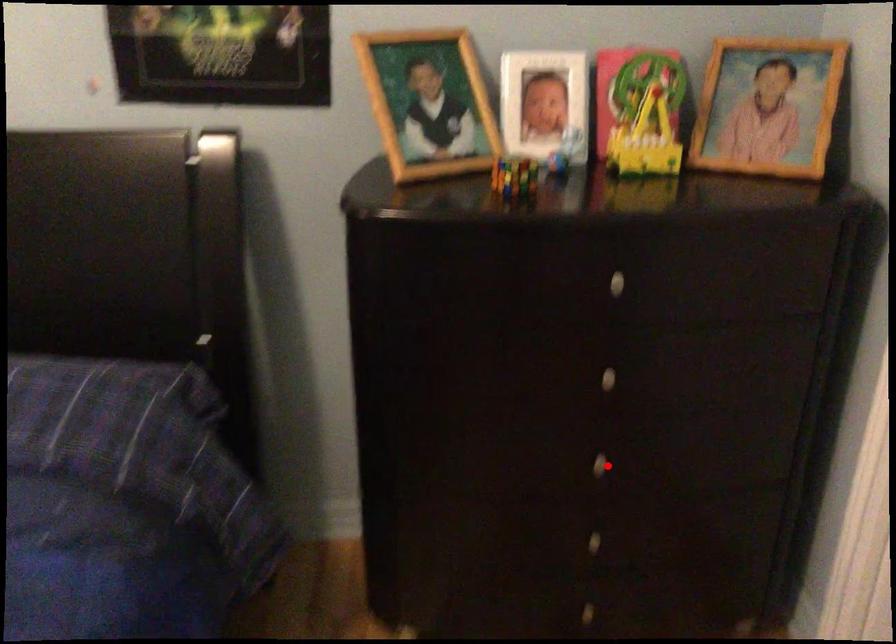
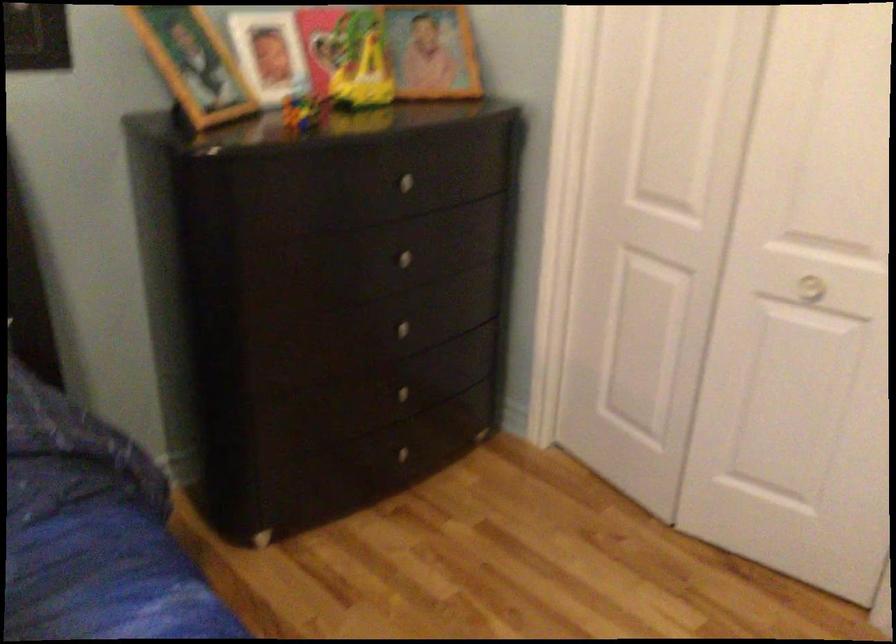
Question: I am providing you with two images of the same scene from different viewpoints. Image1 has a red point marked. In image2, the corresponding 3D location appears at what relative position? Reply with the corresponding letter.

Choices:
 (A) Closer
 (B) Farther

Answer: (B)